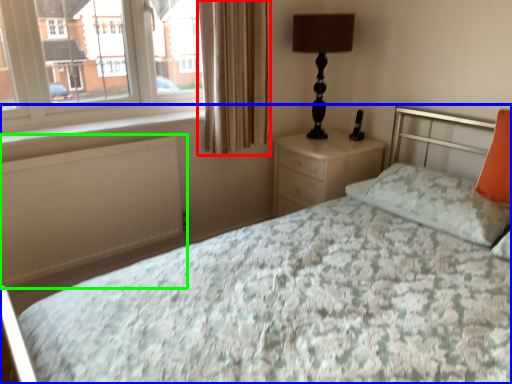
Question: Based on their relative distances, which object is nearer to curtain (highlighted by a red box)? Choose from bed (highlighted by a blue box) and radiator (highlighted by a green box).

Choices:
 (A) bed
 (B) radiator

Answer: (A)